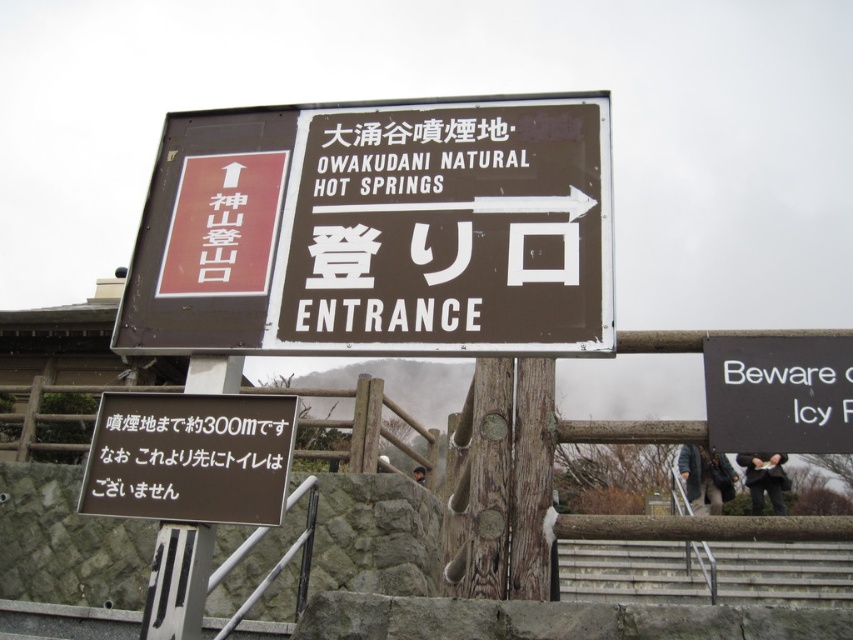
Question: Can you confirm if gray concrete stairs at lower center is wider than black plastic sign at upper right?

Choices:
 (A) yes
 (B) no

Answer: (A)

Question: Which of the following is the closest to the observer?

Choices:
 (A) brownmaterial/texturesign at center
 (B) gray concrete stairs at lower center

Answer: (A)

Question: Which of the following is the closest to the observer?

Choices:
 (A) [224, 234]
 (B) [822, 356]

Answer: (A)

Question: Can you confirm if brown wooden sign at lower center is positioned below gray concrete stairs at lower center?

Choices:
 (A) no
 (B) yes

Answer: (A)

Question: Which object is the closest to the brown wooden sign at lower center?

Choices:
 (A) brownmaterial/texturesign at center
 (B) gray concrete stairs at lower center

Answer: (A)

Question: Does brownmaterial/texturesign at center have a larger size compared to brown wooden sign at lower center?

Choices:
 (A) yes
 (B) no

Answer: (A)